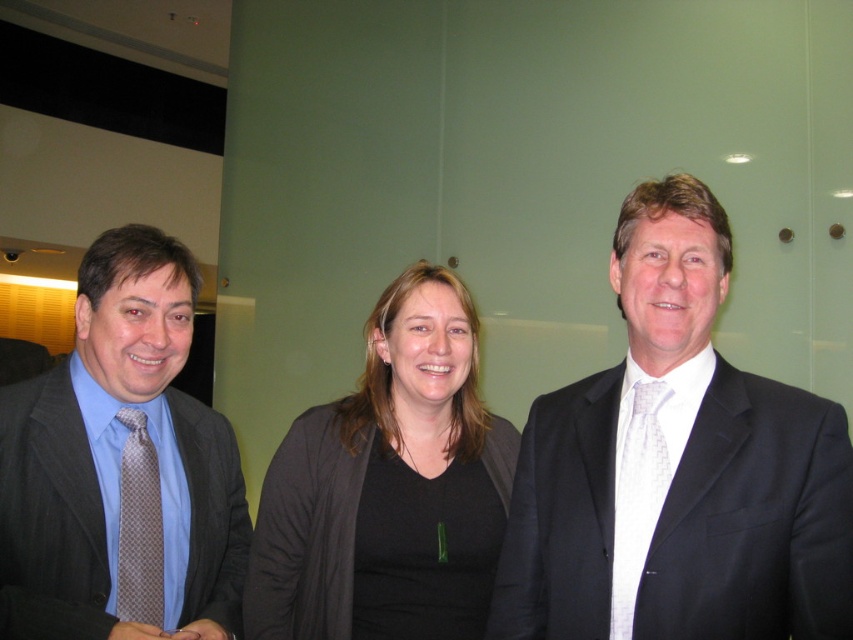
How far apart are dark gray suit at right and black matte cardigan at center?

A distance of 14.21 inches exists between dark gray suit at right and black matte cardigan at center.

Can you confirm if dark gray suit at right is wider than black matte cardigan at center?

Incorrect, dark gray suit at right's width does not surpass black matte cardigan at center's.

You are a GUI agent. You are given a task and a screenshot of the screen. Output one action in this format:
    pyautogui.click(x=<x>, y=<y>)
    Task: Click on the dark gray suit at right
    This screenshot has height=640, width=853.
    Given the screenshot: What is the action you would take?
    pyautogui.click(x=677, y=468)

From the picture: Can you confirm if white textured tie at right is positioned to the right of brown dotted tie at left?

Correct, you'll find white textured tie at right to the right of brown dotted tie at left.

Can you confirm if white textured tie at right is positioned below brown dotted tie at left?

No, white textured tie at right is not below brown dotted tie at left.

Is point (642, 515) behind point (131, 444)?

That is False.

Where is `white textured tie at right`? white textured tie at right is located at coordinates (636, 492).

Between dark gray suit at right and matte brown suit at left, which one appears on the left side from the viewer's perspective?

matte brown suit at left is more to the left.

This screenshot has height=640, width=853. What do you see at coordinates (677, 468) in the screenshot? I see `dark gray suit at right` at bounding box center [677, 468].

Which is behind, point (781, 477) or point (216, 522)?

Positioned behind is point (216, 522).

The width and height of the screenshot is (853, 640). Find the location of `dark gray suit at right`. dark gray suit at right is located at coordinates (677, 468).